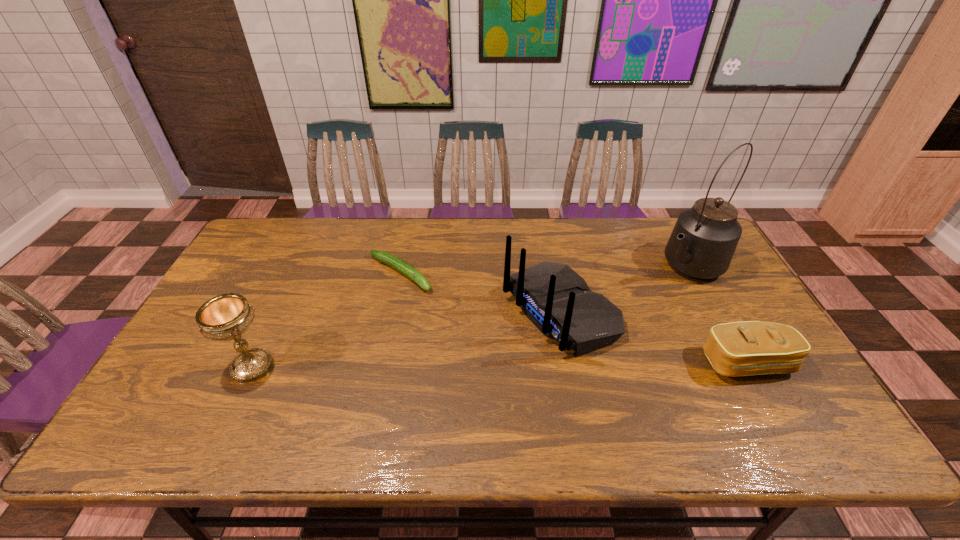
Image resolution: width=960 pixels, height=540 pixels. I want to click on vacant region located 0.220m on the back of the third object from right to left, so click(442, 371).

This screenshot has height=540, width=960. What are the coordinates of `vacant area situated spout on the kettle` in the screenshot? It's located at (576, 340).

Image resolution: width=960 pixels, height=540 pixels. In order to click on free spot located spout on the kettle in this screenshot , I will do `click(601, 323)`.

You are a GUI agent. You are given a task and a screenshot of the screen. Output one action in this format:
    pyautogui.click(x=<x>, y=<y>)
    Task: Click on the vacant space located 0.130m spout on the kettle
    The width and height of the screenshot is (960, 540).
    Given the screenshot: What is the action you would take?
    pyautogui.click(x=638, y=297)

This screenshot has height=540, width=960. Identify the location of free region located on the front-facing side of the zucchini. (452, 306).

What are the coordinates of `free space located 0.080m on the front-facing side of the zucchini` in the screenshot? It's located at (442, 300).

At what (x,y) coordinates should I click in order to perform the action: click on free spot located on the front-facing side of the zucchini. Please return your answer as a coordinate pair (x, y). Image resolution: width=960 pixels, height=540 pixels. Looking at the image, I should click on tap(523, 353).

You are a GUI agent. You are given a task and a screenshot of the screen. Output one action in this format:
    pyautogui.click(x=<x>, y=<y>)
    Task: Click on the kettle that is at the far edge
    The height and width of the screenshot is (540, 960).
    Given the screenshot: What is the action you would take?
    pyautogui.click(x=704, y=239)

The image size is (960, 540). What are the coordinates of `zucchini that is positioned at the far edge` in the screenshot? It's located at (387, 258).

At what (x,y) coordinates should I click in order to perform the action: click on chalice at the near edge. Please return your answer as a coordinate pair (x, y). The image size is (960, 540). Looking at the image, I should click on (226, 317).